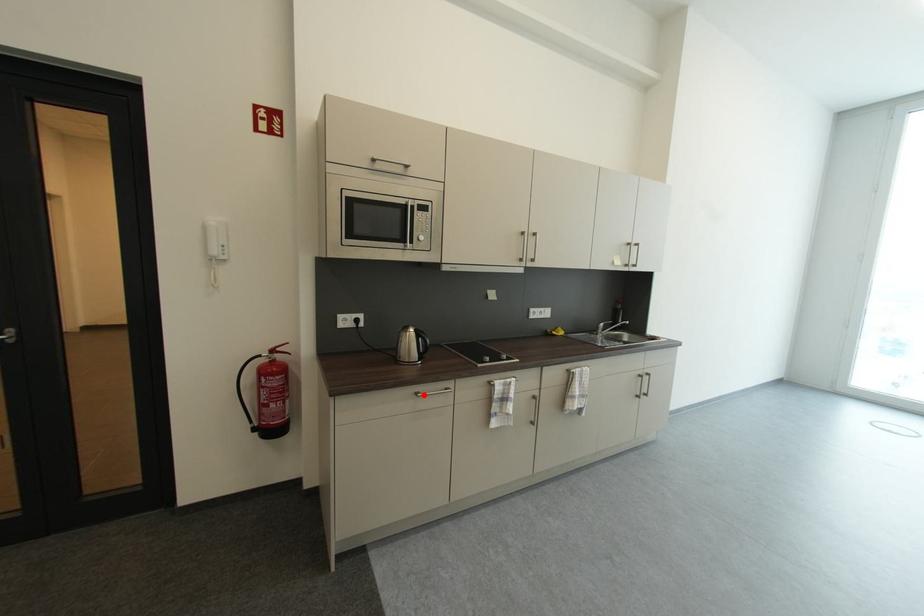
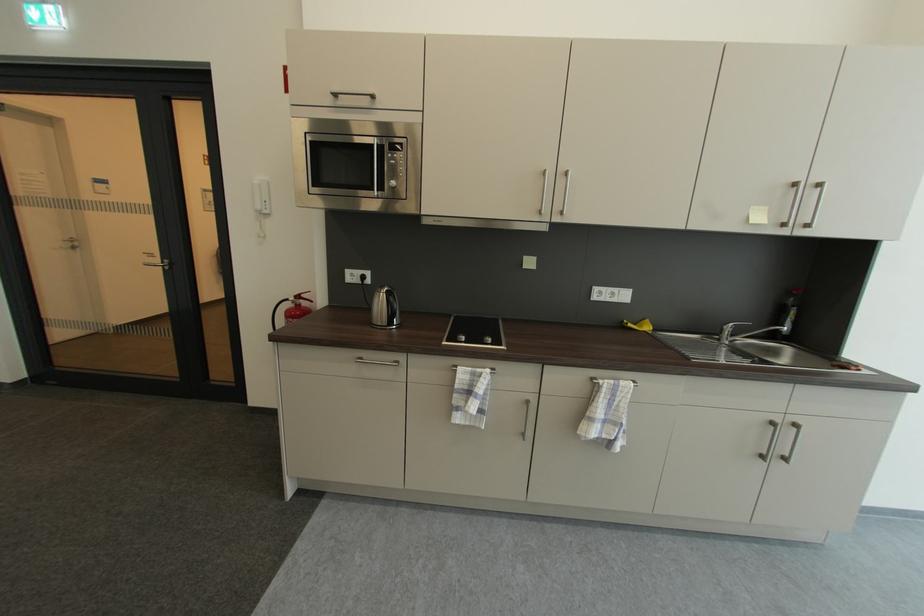
Where in the second image is the point corresponding to the highlighted location from the first image?

(367, 360)